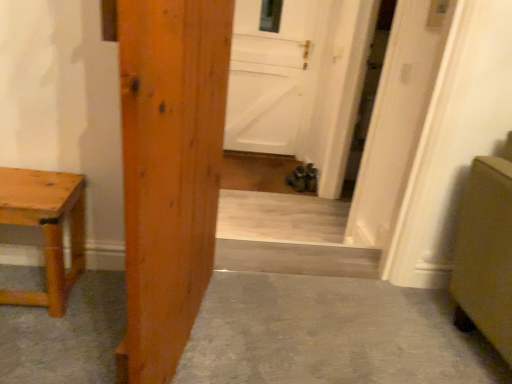
I want to click on free space on the front side of natural wood table at left, so click(32, 340).